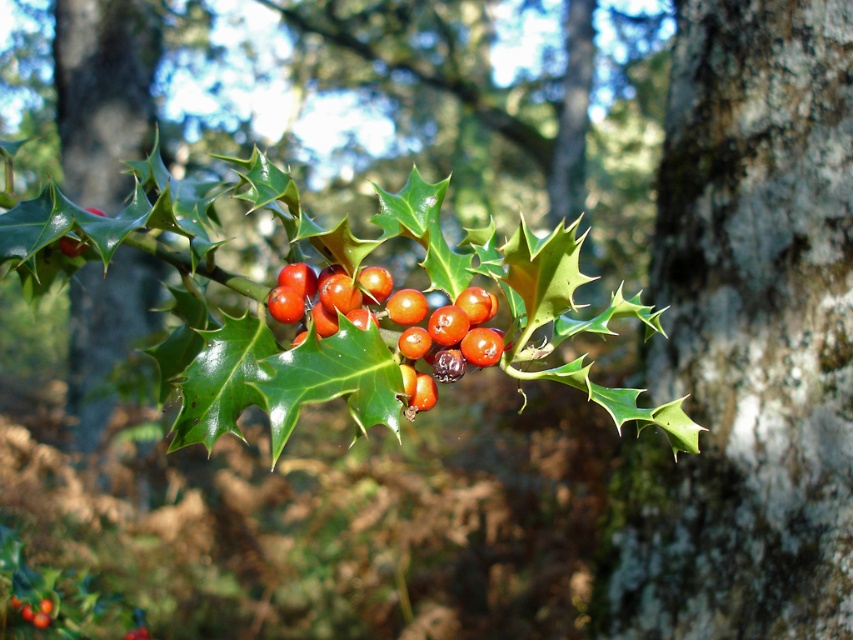
Does smooth gray bark at center have a greater width compared to glossy red berries at center?

Correct, the width of smooth gray bark at center exceeds that of glossy red berries at center.

Does smooth gray bark at center come behind glossy red berries at center?

Yes.

Does point (695, 28) come behind point (483, 336)?

Yes, it is behind point (483, 336).

Where is `smooth gray bark at center`? The height and width of the screenshot is (640, 853). smooth gray bark at center is located at coordinates (752, 330).

Who is positioned more to the right, smooth bark tree trunk at left or glossy red berries at center?

Positioned to the right is glossy red berries at center.

Does point (109, 154) come in front of point (339, 300)?

That is False.

You are a GUI agent. You are given a task and a screenshot of the screen. Output one action in this format:
    pyautogui.click(x=<x>, y=<y>)
    Task: Click on the smooth bark tree trunk at left
    This screenshot has height=640, width=853.
    Given the screenshot: What is the action you would take?
    pyautogui.click(x=103, y=93)

Between smooth gray bark at center and smooth bark tree trunk at left, which one has less height?

smooth bark tree trunk at left is shorter.

Who is positioned more to the right, smooth gray bark at center or smooth bark tree trunk at left?

From the viewer's perspective, smooth gray bark at center appears more on the right side.

The height and width of the screenshot is (640, 853). What are the coordinates of `smooth gray bark at center` in the screenshot? It's located at (752, 330).